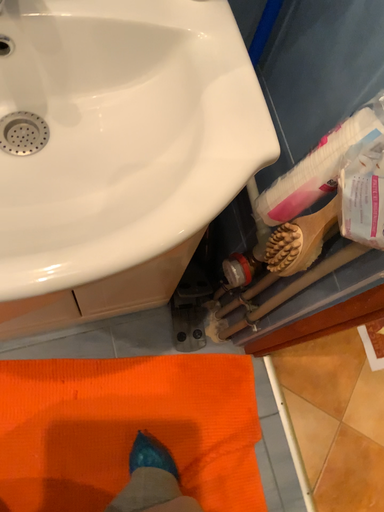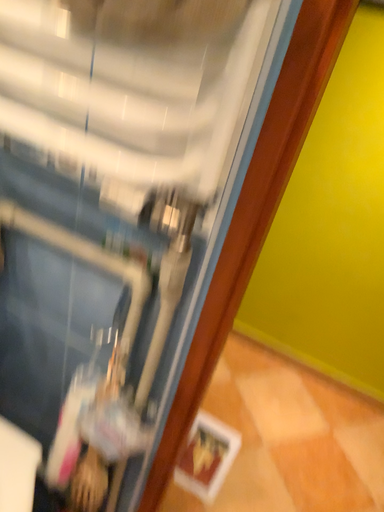
Question: How did the camera likely rotate when shooting the video?

Choices:
 (A) rotated upward
 (B) rotated downward

Answer: (A)